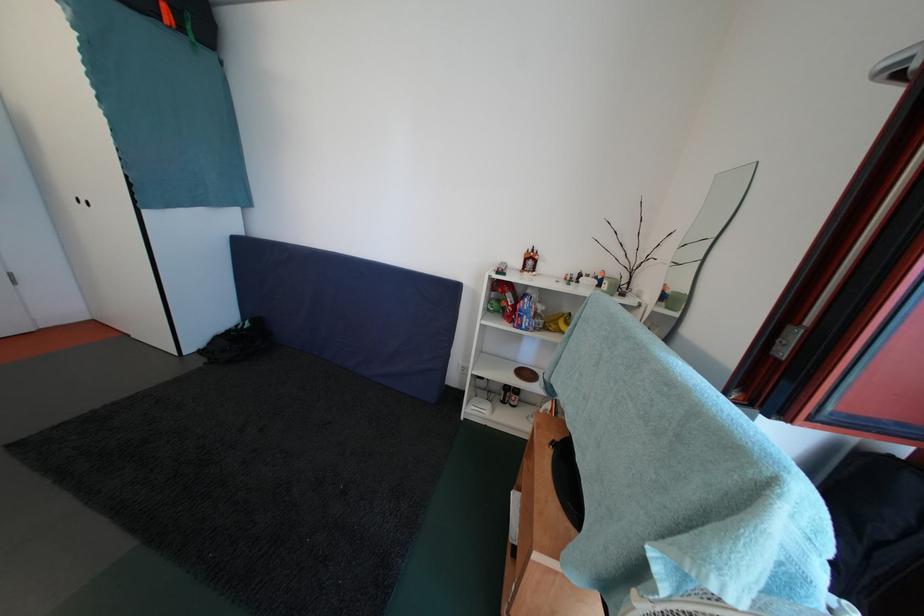
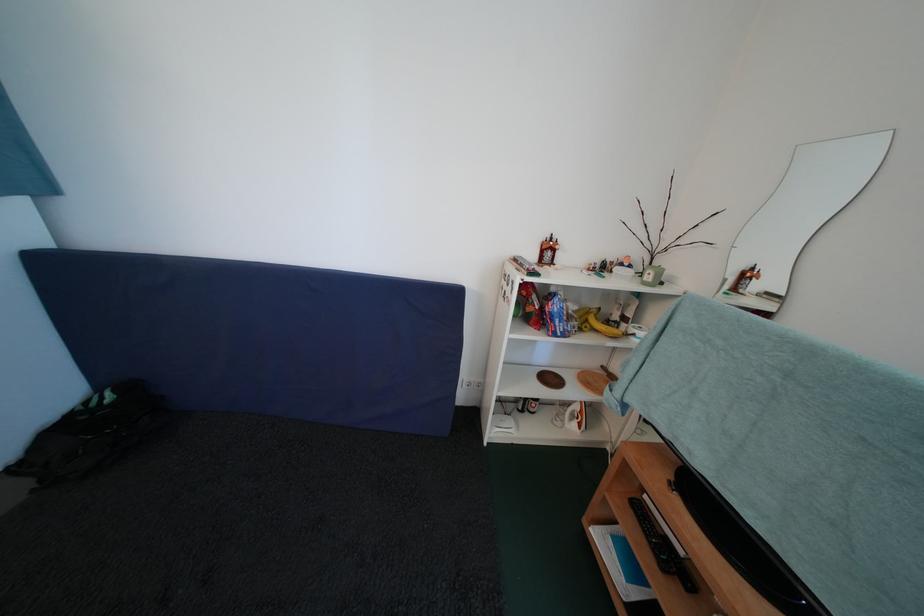
Locate, in the second image, the point that corresponds to pixel 532 379 in the first image.

(556, 384)